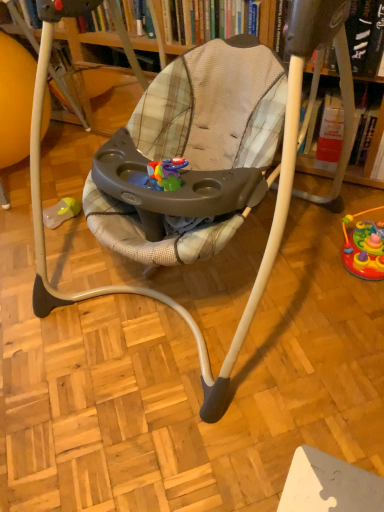
Where is `free space in front of plaid fabric baby swing at center`? free space in front of plaid fabric baby swing at center is located at coordinates (213, 423).